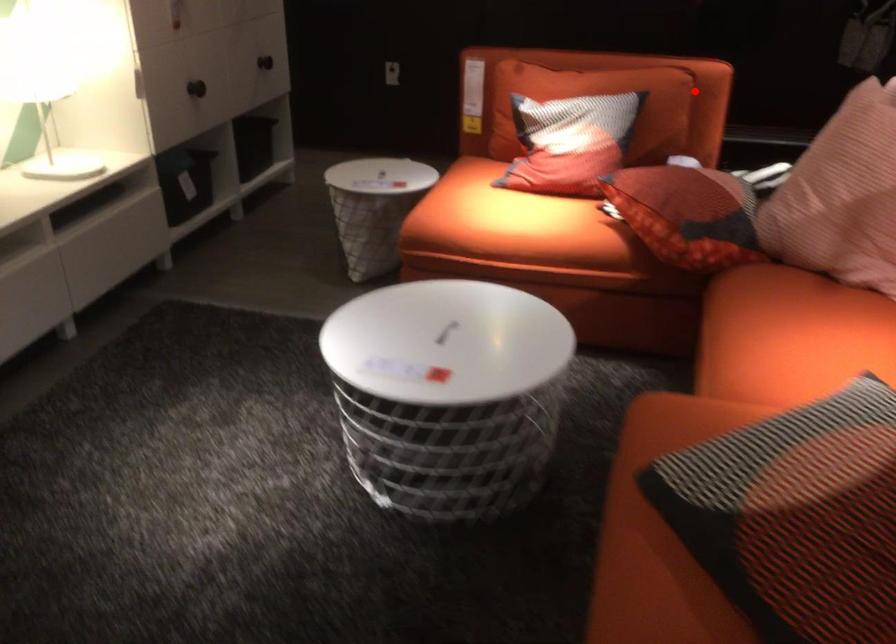
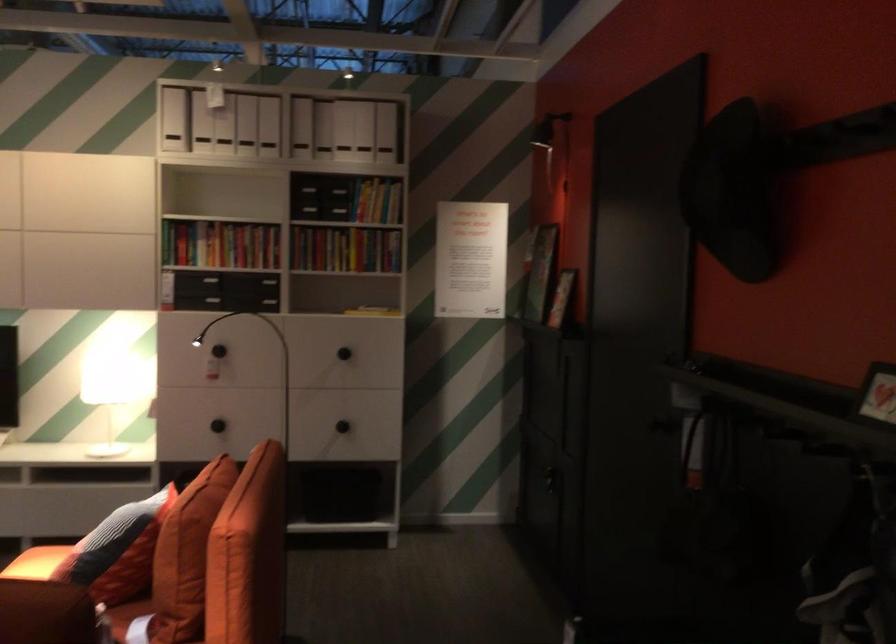
The point at the highlighted location is marked in the first image. Where is the corresponding point in the second image?

(186, 554)